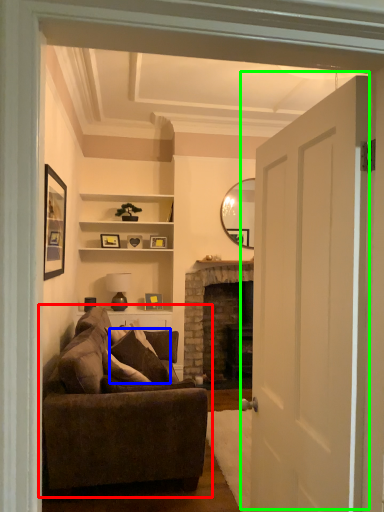
Question: Estimate the real-world distances between objects in this image. Which object is closer to studio couch (highlighted by a red box), pillow (highlighted by a blue box) or door (highlighted by a green box)?

Choices:
 (A) pillow
 (B) door

Answer: (A)